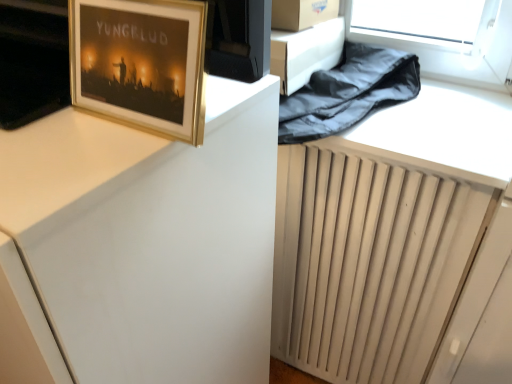
What are the coordinates of `gold-framed picture at upper left` in the screenshot? It's located at (140, 63).

In order to face gold-framed picture at upper left, should I rotate leftwards or rightwards?

Result: To face it directly, rotate left by 15.519 degrees.

What do you see at coordinates (140, 63) in the screenshot? I see `gold-framed picture at upper left` at bounding box center [140, 63].

What do you see at coordinates (151, 239) in the screenshot? I see `white matte computer desk at upper left` at bounding box center [151, 239].

In order to face white matte computer desk at upper left, should I rotate leftwards or rightwards?

Turn left approximately 27.540 degrees to face it.

Where is `white matte computer desk at upper left`? The image size is (512, 384). white matte computer desk at upper left is located at coordinates (151, 239).

In the scene shown: What is the approximate width of white matte computer desk at upper left?

white matte computer desk at upper left is 51.87 centimeters in width.

Find the location of a particular element. gold-framed picture at upper left is located at coordinates (140, 63).

Is gold-framed picture at upper left to the right of white matte computer desk at upper left from the viewer's perspective?

Yes.

Is the position of gold-framed picture at upper left more distant than that of white matte computer desk at upper left?

Yes, the depth of gold-framed picture at upper left is greater than that of white matte computer desk at upper left.

Is point (130, 49) closer to viewer compared to point (205, 315)?

That is True.

From the image's perspective, which object appears higher, gold-framed picture at upper left or white matte computer desk at upper left?

gold-framed picture at upper left appears higher in the image.

From a real-world perspective, is gold-framed picture at upper left located beneath white matte computer desk at upper left?

Actually, gold-framed picture at upper left is physically above white matte computer desk at upper left in the real world.

Considering the sizes of gold-framed picture at upper left and white matte computer desk at upper left in the image, is gold-framed picture at upper left wider or thinner than white matte computer desk at upper left?

In the image, gold-framed picture at upper left appears to be more narrow than white matte computer desk at upper left.

Considering the sizes of objects gold-framed picture at upper left and white matte computer desk at upper left in the image provided, who is shorter, gold-framed picture at upper left or white matte computer desk at upper left?

Standing shorter between the two is gold-framed picture at upper left.

Can you confirm if gold-framed picture at upper left is bigger than white matte computer desk at upper left?

Actually, gold-framed picture at upper left might be smaller than white matte computer desk at upper left.

From the picture: Is white matte computer desk at upper left inside gold-framed picture at upper left?

Definitely not — white matte computer desk at upper left is not inside gold-framed picture at upper left.

Are gold-framed picture at upper left and white matte computer desk at upper left far apart?

No, there isn't a large distance between gold-framed picture at upper left and white matte computer desk at upper left.

Is gold-framed picture at upper left facing towards white matte computer desk at upper left?

No, gold-framed picture at upper left is not turned towards white matte computer desk at upper left.

What's the angular difference between gold-framed picture at upper left and white matte computer desk at upper left's facing directions?

There is a 0.806-degree angle between the facing directions of gold-framed picture at upper left and white matte computer desk at upper left.

How distant is gold-framed picture at upper left from white matte computer desk at upper left?

A distance of 8.03 inches exists between gold-framed picture at upper left and white matte computer desk at upper left.

I want to click on computer desk lying on the left of gold-framed picture at upper left, so click(151, 239).

Considering the positions of objects white matte computer desk at upper left and gold-framed picture at upper left in the image provided, who is more to the left, white matte computer desk at upper left or gold-framed picture at upper left?

Positioned to the left is white matte computer desk at upper left.

Relative to gold-framed picture at upper left, is white matte computer desk at upper left in front or behind?

Clearly, white matte computer desk at upper left is in front of gold-framed picture at upper left.

Between point (165, 248) and point (157, 93), which one is positioned behind?

The point (165, 248) is farther.

From the image's perspective, is white matte computer desk at upper left above or below gold-framed picture at upper left?

white matte computer desk at upper left is below gold-framed picture at upper left.

From a real-world perspective, who is located lower, white matte computer desk at upper left or gold-framed picture at upper left?

From a 3D spatial view, white matte computer desk at upper left is below.

Which of these two, white matte computer desk at upper left or gold-framed picture at upper left, is wider?

white matte computer desk at upper left.

Between white matte computer desk at upper left and gold-framed picture at upper left, which one has more height?

With more height is white matte computer desk at upper left.

Considering the relative sizes of white matte computer desk at upper left and gold-framed picture at upper left in the image provided, is white matte computer desk at upper left bigger than gold-framed picture at upper left?

Correct, white matte computer desk at upper left is larger in size than gold-framed picture at upper left.

Is white matte computer desk at upper left situated inside gold-framed picture at upper left or outside?

white matte computer desk at upper left is located beyond the bounds of gold-framed picture at upper left.

From the picture: Is white matte computer desk at upper left not near gold-framed picture at upper left?

That's not correct — white matte computer desk at upper left is a little close to gold-framed picture at upper left.

Is white matte computer desk at upper left oriented away from gold-framed picture at upper left?

No, gold-framed picture at upper left is not at the back of white matte computer desk at upper left.

In order to click on picture frame on the right of white matte computer desk at upper left in this screenshot , I will do `click(140, 63)`.

Where is `picture frame behind the white matte computer desk at upper left`? This screenshot has width=512, height=384. picture frame behind the white matte computer desk at upper left is located at coordinates (140, 63).

In order to click on picture frame above the white matte computer desk at upper left (from the image's perspective) in this screenshot , I will do `click(140, 63)`.